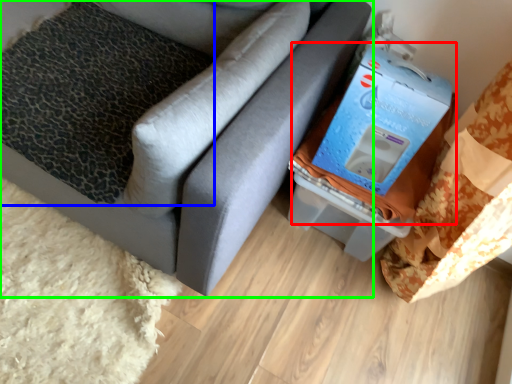
Question: Which is nearer to the storage box (highlighted by a red box)? pillow (highlighted by a blue box) or furniture (highlighted by a green box).

Choices:
 (A) pillow
 (B) furniture

Answer: (B)